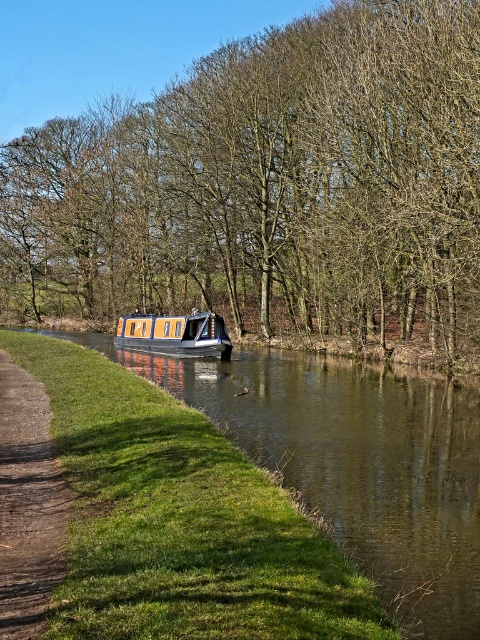
You are a photographer planning to capture the orange polished wood boat at center and the brown leafless trees at center in a single shot. Based on their sizes in the image, which object should you focus on first to ensure both are in frame?

The brown leafless trees at center are larger in size than the orange polished wood boat at center, so focusing on the larger trees first will help ensure both fit within the frame.

You are standing on the grassy bank near the dirt path and want to walk towards the narrowboat. Which point, point (0, 433) or point (135, 340), should you aim for to reach the narrowboat first?

You should aim for point (0, 433) because it is in front of point (135, 340), meaning it is closer to the narrowboat.

You are standing on the grassy bank and want to take a photo of the brown leafless trees at center and the smooth brown water at center. Which object will appear closer to you in the photo?

The brown leafless trees at center will appear closer to you in the photo because the smooth brown water at center is behind them.